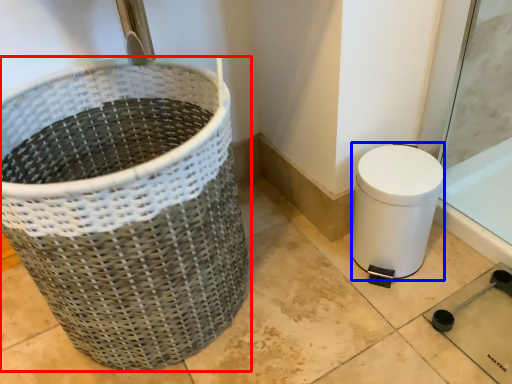
Question: Which of the following is the closest to the observer, waste container (highlighted by a red box) or toilet bowl (highlighted by a blue box)?

Choices:
 (A) waste container
 (B) toilet bowl

Answer: (A)